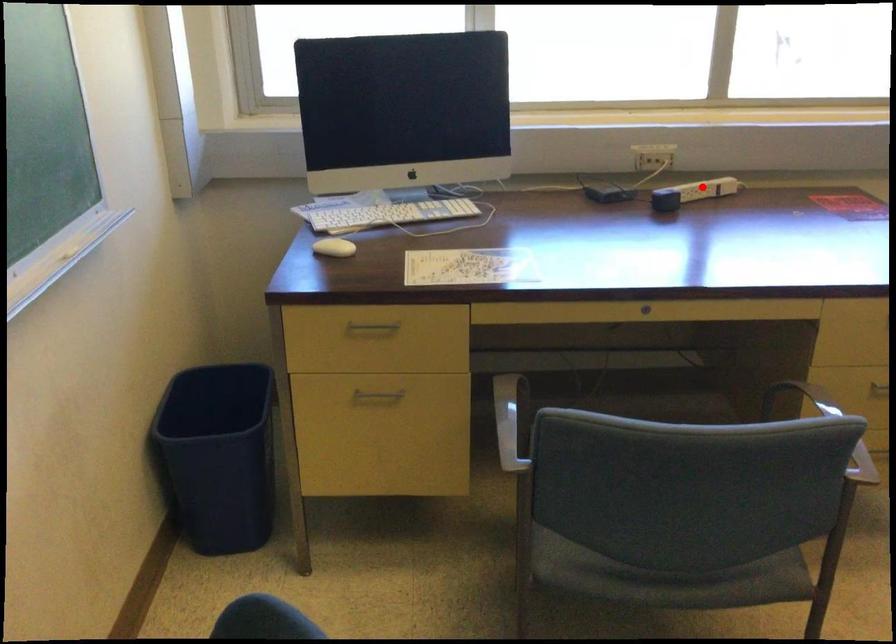
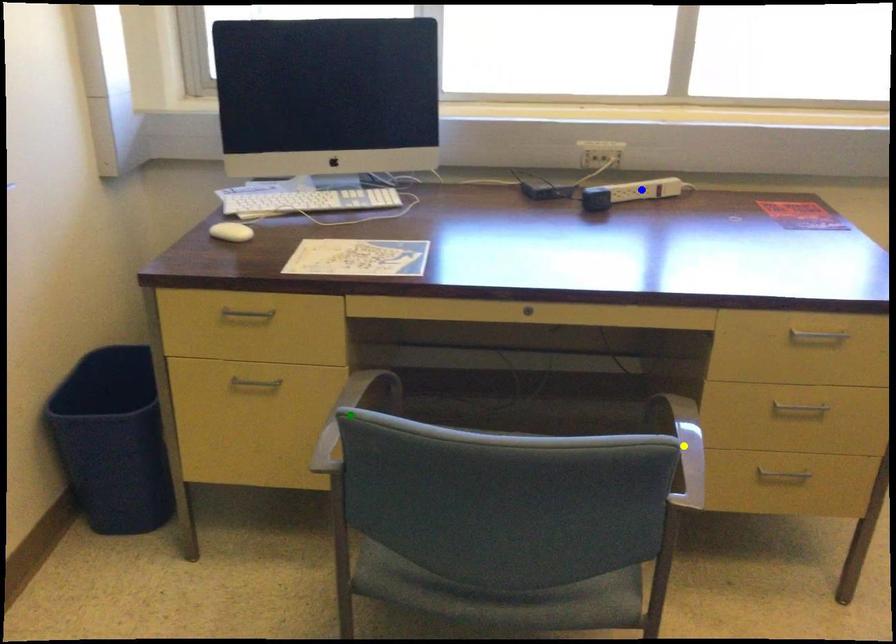
Question: I am providing you with two images of the same scene from different viewpoints. A red point is marked on the first image. You are given multiple points on the second image. Which mark in image 2 goes with the point in image 1?

Choices:
 (A) yellow point
 (B) blue point
 (C) green point

Answer: (B)